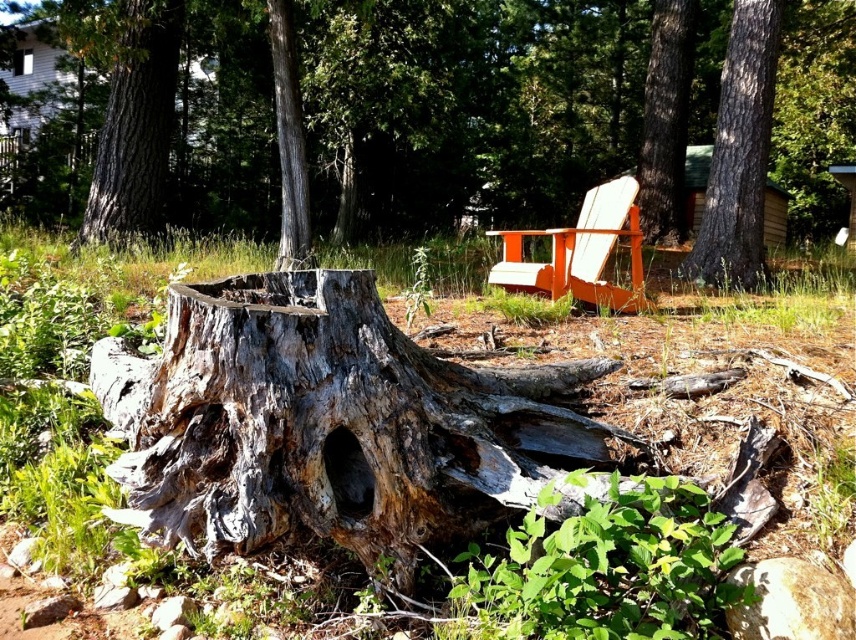
Looking at this image, who is more forward, [307,392] or [669,221]?

Positioned in front is point [307,392].

Which is behind, point (300, 326) or point (657, 20)?

Positioned behind is point (657, 20).

Where is `weathered wood tree stump at center`? This screenshot has width=856, height=640. weathered wood tree stump at center is located at coordinates 325,422.

Is orange wood chair at center further to the viewer compared to gray rough bark tree trunk at center?

No.

Is orange wood chair at center positioned in front of gray rough bark tree trunk at center?

Yes.

Who is more forward, (622, 209) or (296, 90)?

Point (622, 209)

At what (x,y) coordinates should I click in order to perform the action: click on orange wood chair at center. Please return your answer as a coordinate pair (x, y). Image resolution: width=856 pixels, height=640 pixels. Looking at the image, I should click on (581, 252).

Consider the image. Does smooth bark tree trunk at center have a greater width compared to orange wood chair at center?

No, smooth bark tree trunk at center is not wider than orange wood chair at center.

Where is `smooth bark tree trunk at center`? The image size is (856, 640). smooth bark tree trunk at center is located at coordinates (739, 154).